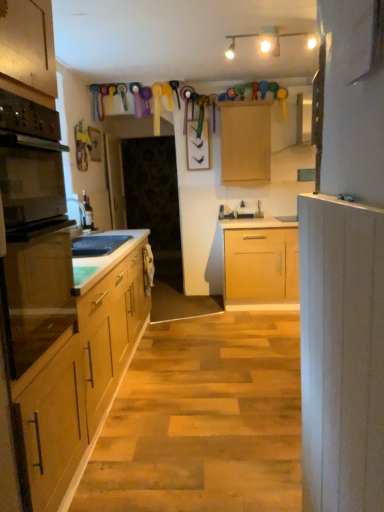
The height and width of the screenshot is (512, 384). What do you see at coordinates (97, 245) in the screenshot?
I see `black matte sink at left` at bounding box center [97, 245].

What is the approximate width of black glass oven at left?

16.40 inches.

Find the location of a particular element. Image resolution: width=384 pixels, height=512 pixels. matte wood cabinet at center, which is counted as the 1th cabinetry, starting from the top is located at coordinates (245, 142).

From a real-world perspective, which is physically above, white painted wood cabinet at right, which appears as the 2th cabinetry when viewed from the top, or black glass oven at left?

From a 3D spatial view, black glass oven at left is above.

Considering the positions of objects white painted wood cabinet at right, placed as the first cabinetry when sorted from bottom to top, and black glass oven at left in the image provided, who is more to the right, white painted wood cabinet at right, placed as the first cabinetry when sorted from bottom to top, or black glass oven at left?

Positioned to the right is white painted wood cabinet at right, placed as the first cabinetry when sorted from bottom to top.

Considering the positions of point (303, 490) and point (10, 322), is point (303, 490) closer or farther from the camera than point (10, 322)?

Point (303, 490).

From the image's perspective, does white painted wood cabinet at right, which appears as the 2th cabinetry when viewed from the top, appear higher than black glass oven at left?

No, from the image's perspective, white painted wood cabinet at right, which appears as the 2th cabinetry when viewed from the top, is not above black glass oven at left.

Find the location of a particular element. The image size is (384, 512). oven that appears below the matte wood cabinet at center, which is the second cabinetry in bottom-to-top order (from a real-world perspective) is located at coordinates (33, 231).

Considering the sizes of objects matte wood cabinet at center, which is counted as the 1th cabinetry, starting from the top, and black glass oven at left in the image provided, who is shorter, matte wood cabinet at center, which is counted as the 1th cabinetry, starting from the top, or black glass oven at left?

Standing shorter between the two is matte wood cabinet at center, which is counted as the 1th cabinetry, starting from the top.

Is matte wood cabinet at center, which is the second cabinetry in bottom-to-top order, in front of or behind black glass oven at left in the image?

Clearly, matte wood cabinet at center, which is the second cabinetry in bottom-to-top order, is behind black glass oven at left.

Is black matte sink at left placed right next to matte wood cabinet at center, which is counted as the 1th cabinetry, starting from the top?

No, black matte sink at left is not next to matte wood cabinet at center, which is counted as the 1th cabinetry, starting from the top.

How far apart are black matte sink at left and matte wood cabinet at center, which ranks as the first cabinetry in back-to-front order?

black matte sink at left and matte wood cabinet at center, which ranks as the first cabinetry in back-to-front order, are 5.77 feet apart.

In the image, there is a black matte sink at left. Where is `cabinetry above it (from the image's perspective)`? Image resolution: width=384 pixels, height=512 pixels. cabinetry above it (from the image's perspective) is located at coordinates (245, 142).

Is the position of white painted wood cabinet at right, placed as the first cabinetry when sorted from bottom to top, more distant than that of white frosted glass light fixture at upper center?

No.

Is white painted wood cabinet at right, acting as the 2th cabinetry starting from the back, positioned far away from white frosted glass light fixture at upper center?

Absolutely, white painted wood cabinet at right, acting as the 2th cabinetry starting from the back, is distant from white frosted glass light fixture at upper center.

Considering the relative sizes of white painted wood cabinet at right, placed as the first cabinetry when sorted from bottom to top, and white frosted glass light fixture at upper center in the image provided, is white painted wood cabinet at right, placed as the first cabinetry when sorted from bottom to top, shorter than white frosted glass light fixture at upper center?

No, white painted wood cabinet at right, placed as the first cabinetry when sorted from bottom to top, is not shorter than white frosted glass light fixture at upper center.

Is matte wood cabinet at center, which is the second cabinetry in bottom-to-top order, beside black matte sink at left?

No, matte wood cabinet at center, which is the second cabinetry in bottom-to-top order, is not with black matte sink at left.

From the image's perspective, is matte wood cabinet at center, which is the second cabinetry in bottom-to-top order, on black matte sink at left?

Yes.

From a real-world perspective, is matte wood cabinet at center, which ranks as the first cabinetry in back-to-front order, positioned under black matte sink at left based on gravity?

No, from a real-world perspective, matte wood cabinet at center, which ranks as the first cabinetry in back-to-front order, is not below black matte sink at left.

Could black matte sink at left be considered to be inside black glass oven at left?

No, black matte sink at left is not surrounded by black glass oven at left.

From a real-world perspective, does black glass oven at left sit lower than black matte sink at left?

No, from a real-world perspective, black glass oven at left is not under black matte sink at left.

Is black glass oven at left to the right of black matte sink at left from the viewer's perspective?

Yes, black glass oven at left is to the right of black matte sink at left.

Does point (9, 201) come in front of point (118, 247)?

Yes, it is in front of point (118, 247).

Is black glass oven at left wider than white painted wood cabinet at right, placed as the first cabinetry when sorted from bottom to top?

No.

Considering the relative positions of black glass oven at left and white painted wood cabinet at right, which appears as the 2th cabinetry when viewed from the top, in the image provided, is black glass oven at left in front of white painted wood cabinet at right, which appears as the 2th cabinetry when viewed from the top,?

No.

Considering the positions of objects black glass oven at left and white painted wood cabinet at right, which is counted as the 1th cabinetry, starting from the front, in the image provided, who is more to the right, black glass oven at left or white painted wood cabinet at right, which is counted as the 1th cabinetry, starting from the front,?

From the viewer's perspective, white painted wood cabinet at right, which is counted as the 1th cabinetry, starting from the front, appears more on the right side.

Identify the location of cabinetry lying below the black glass oven at left (from the image's perspective). (341, 354).

This screenshot has width=384, height=512. I want to click on cabinetry above the black glass oven at left (from a real-world perspective), so click(245, 142).

From the image, which object appears to be nearer to white painted wood cabinet at right, placed as the first cabinetry when sorted from bottom to top, matte wood cabinet at center, which is counted as the 1th cabinetry, starting from the top, or black matte sink at left?

Among the two, black matte sink at left is located nearer to white painted wood cabinet at right, placed as the first cabinetry when sorted from bottom to top.

Which object lies nearer to the anchor point black glass oven at left, black matte sink at left or matte wood cabinet at center, which ranks as the first cabinetry in back-to-front order?

Among the two, black matte sink at left is located nearer to black glass oven at left.

When comparing their distances from matte wood cabinet at center, which is the second cabinetry in bottom-to-top order, does white frosted glass light fixture at upper center or black glass oven at left seem further?

Among the two, black glass oven at left is located further to matte wood cabinet at center, which is the second cabinetry in bottom-to-top order.

Which object lies nearer to the anchor point white frosted glass light fixture at upper center, white painted wood cabinet at right, which is counted as the 1th cabinetry, starting from the front, or black matte sink at left?

black matte sink at left.

Based on their spatial positions, is white frosted glass light fixture at upper center or black glass oven at left closer to black matte sink at left?

black glass oven at left lies closer to black matte sink at left than the other object.

In the scene shown: Estimate the real-world distances between objects in this image. Which object is further from white painted wood cabinet at right, which is counted as the 1th cabinetry, starting from the front, black matte sink at left or matte wood cabinet at center, which is the second cabinetry in bottom-to-top order?

matte wood cabinet at center, which is the second cabinetry in bottom-to-top order, is positioned further to the anchor white painted wood cabinet at right, which is counted as the 1th cabinetry, starting from the front.

Estimate the real-world distances between objects in this image. Which object is further from white painted wood cabinet at right, which is counted as the 1th cabinetry, starting from the front, matte wood cabinet at center, which is the second cabinetry in bottom-to-top order, or black glass oven at left?

Among the two, matte wood cabinet at center, which is the second cabinetry in bottom-to-top order, is located further to white painted wood cabinet at right, which is counted as the 1th cabinetry, starting from the front.

Based on their spatial positions, is white painted wood cabinet at right, placed as the first cabinetry when sorted from bottom to top, or matte wood cabinet at center, which is counted as the 1th cabinetry, starting from the top, closer to black matte sink at left?

The object closer to black matte sink at left is matte wood cabinet at center, which is counted as the 1th cabinetry, starting from the top.

Where is `oven between white painted wood cabinet at right, acting as the 2th cabinetry starting from the back, and white frosted glass light fixture at upper center, along the z-axis`? This screenshot has height=512, width=384. oven between white painted wood cabinet at right, acting as the 2th cabinetry starting from the back, and white frosted glass light fixture at upper center, along the z-axis is located at coordinates (33, 231).

Where is `sink between white frosted glass light fixture at upper center and matte wood cabinet at center, which is counted as the 1th cabinetry, starting from the top, along the z-axis`? sink between white frosted glass light fixture at upper center and matte wood cabinet at center, which is counted as the 1th cabinetry, starting from the top, along the z-axis is located at coordinates (97, 245).

Locate an element on the screen. The image size is (384, 512). light fixture located between white painted wood cabinet at right, acting as the 2th cabinetry starting from the back, and matte wood cabinet at center, which is counted as the 1th cabinetry, starting from the top, in the depth direction is located at coordinates (263, 40).

You are a GUI agent. You are given a task and a screenshot of the screen. Output one action in this format:
    pyautogui.click(x=<x>, y=<y>)
    Task: Click on the oven between white painted wood cabinet at right, which appears as the 2th cabinetry when viewed from the top, and matte wood cabinet at center, which ranks as the first cabinetry in back-to-front order, from front to back
    The width and height of the screenshot is (384, 512).
    Given the screenshot: What is the action you would take?
    pyautogui.click(x=33, y=231)